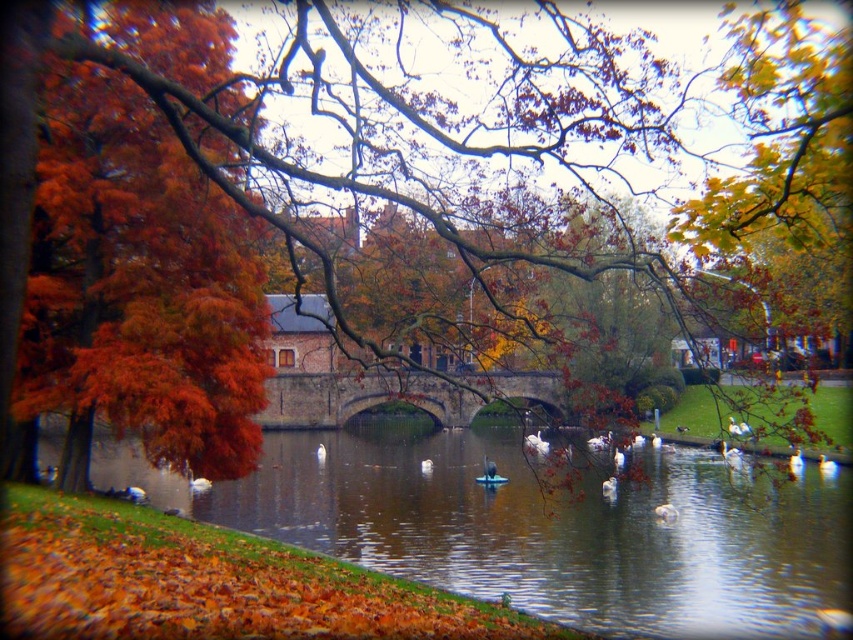
Who is positioned more to the right, brown reflective water at center or brown stone bridge at center?

brown reflective water at center

Does point (178, 499) lie behind point (550, 390)?

No, it is in front of (550, 390).

Locate an element on the screen. The image size is (853, 640). brown reflective water at center is located at coordinates [540, 525].

Between vivid orange leaves at left and brown stone bridge at center, which one appears on the right side from the viewer's perspective?

brown stone bridge at center

You are a GUI agent. You are given a task and a screenshot of the screen. Output one action in this format:
    pyautogui.click(x=<x>, y=<y>)
    Task: Click on the vivid orange leaves at left
    
    Given the screenshot: What is the action you would take?
    pyautogui.click(x=136, y=288)

This screenshot has height=640, width=853. In order to click on vivid orange leaves at left in this screenshot , I will do `click(136, 288)`.

Is the position of brown reflective water at center less distant than that of vivid orange leaves at left?

No, brown reflective water at center is behind vivid orange leaves at left.

Is brown reflective water at center smaller than vivid orange leaves at left?

No, brown reflective water at center is not smaller than vivid orange leaves at left.

Where is `brown reflective water at center`? The height and width of the screenshot is (640, 853). brown reflective water at center is located at coordinates (540, 525).

Find the location of a particular element. The width and height of the screenshot is (853, 640). brown reflective water at center is located at coordinates (540, 525).